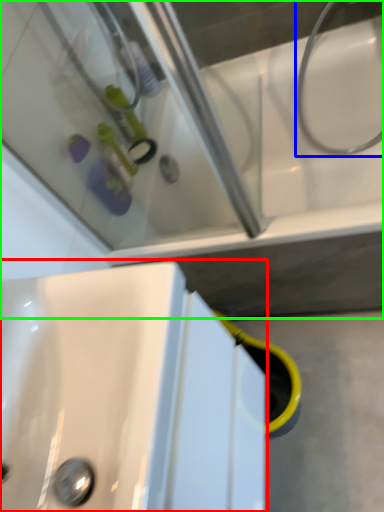
Question: Which object is the farthest from sink (highlighted by a red box)? Choose among these: plumbing fixture (highlighted by a blue box) or bath (highlighted by a green box).

Choices:
 (A) plumbing fixture
 (B) bath

Answer: (A)